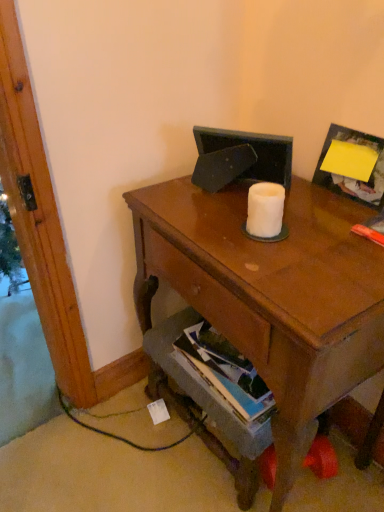
Locate an element on the screen. The image size is (384, 512). free space above matte brown desk at center (from a real-world perspective) is located at coordinates (284, 228).